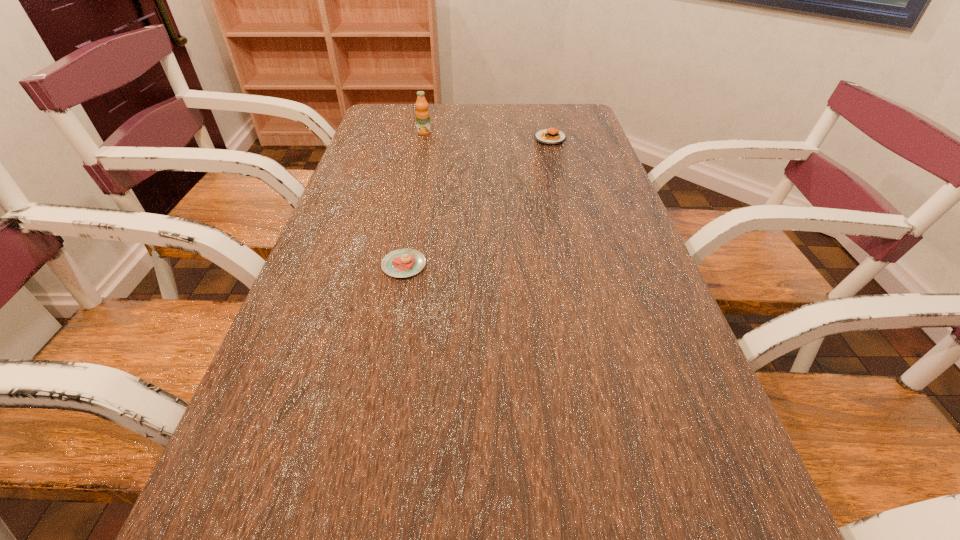
Find the location of `orange juice`. orange juice is located at coordinates (422, 114).

Image resolution: width=960 pixels, height=540 pixels. What are the coordinates of `the second tallest object` in the screenshot? It's located at (551, 136).

This screenshot has height=540, width=960. In order to click on food in this screenshot , I will do `click(551, 136)`.

Where is `the shortest object`? The height and width of the screenshot is (540, 960). the shortest object is located at coordinates (400, 263).

At what (x,y) coordinates should I click in order to perform the action: click on pastry. Please return your answer as a coordinate pair (x, y). Image resolution: width=960 pixels, height=540 pixels. Looking at the image, I should click on (400, 263).

Where is `blank space located 0.090m on the label of the orange juice`? The width and height of the screenshot is (960, 540). blank space located 0.090m on the label of the orange juice is located at coordinates (420, 149).

At what (x,y) coordinates should I click in order to perform the action: click on blank area located on the left of the second tallest object. Please return your answer as a coordinate pair (x, y). The width and height of the screenshot is (960, 540). Looking at the image, I should click on pos(463,139).

You are a GUI agent. You are given a task and a screenshot of the screen. Output one action in this format:
    pyautogui.click(x=<x>, y=<y>)
    Task: Click on the free region located on the left of the shortest object
    The height and width of the screenshot is (540, 960).
    Given the screenshot: What is the action you would take?
    pyautogui.click(x=337, y=265)

The height and width of the screenshot is (540, 960). Identify the location of orange juice that is at the far edge. (422, 114).

Locate an element on the screen. This screenshot has height=540, width=960. food that is at the far edge is located at coordinates (551, 136).